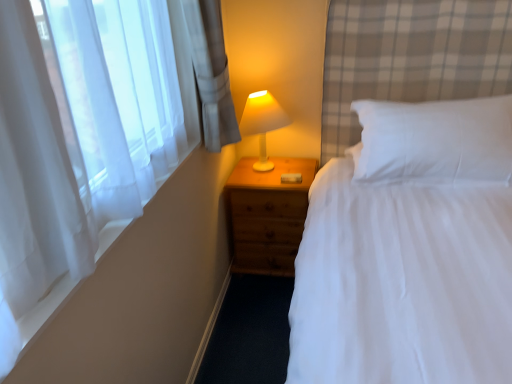
Question: Considering the positions of white soft pillow at upper right and wooden nightstand at center in the image, is white soft pillow at upper right bigger or smaller than wooden nightstand at center?

Choices:
 (A) big
 (B) small

Answer: (B)

Question: From the image's perspective, is white soft pillow at upper right above or below wooden nightstand at center?

Choices:
 (A) above
 (B) below

Answer: (A)

Question: Which is nearer to the white soft pillow at upper right?

Choices:
 (A) sheer white curtain at left
 (B) wooden nightstand at center
 (C) white plastic lamp at upper right

Answer: (B)

Question: Which is nearer to the wooden nightstand at center?

Choices:
 (A) white soft pillow at upper right
 (B) white plastic lamp at upper right
 (C) sheer white curtain at left

Answer: (B)